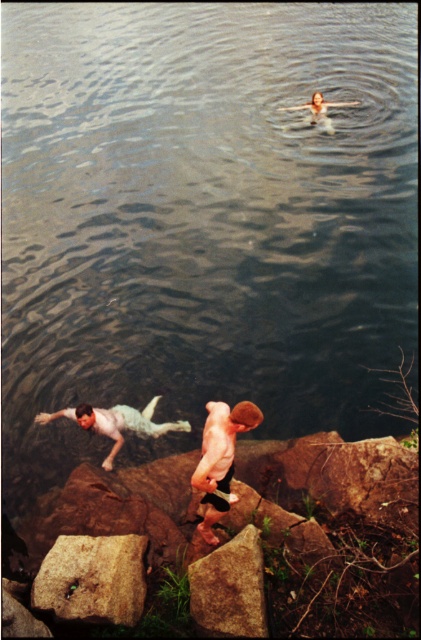
Question: Among these points, which one is farthest from the camera?

Choices:
 (A) 98,420
 (B) 71,552
 (C) 205,509

Answer: (A)

Question: Which point is closer to the camera taking this photo?

Choices:
 (A) (248, 634)
 (B) (245, 401)
 (C) (63, 561)

Answer: (A)

Question: Considering the relative positions of smooth skin man at center and light blue fabric swim trunks at left in the image provided, where is smooth skin man at center located with respect to light blue fabric swim trunks at left?

Choices:
 (A) left
 (B) right

Answer: (B)

Question: Which point appears closest to the camera in this image?

Choices:
 (A) (218, 577)
 (B) (111, 458)

Answer: (A)

Question: Can you confirm if brown rough rock at center is wider than smooth skin man at center?

Choices:
 (A) yes
 (B) no

Answer: (A)

Question: Does brown rough rock at center lie behind light blue fabric swim trunks at left?

Choices:
 (A) no
 (B) yes

Answer: (A)